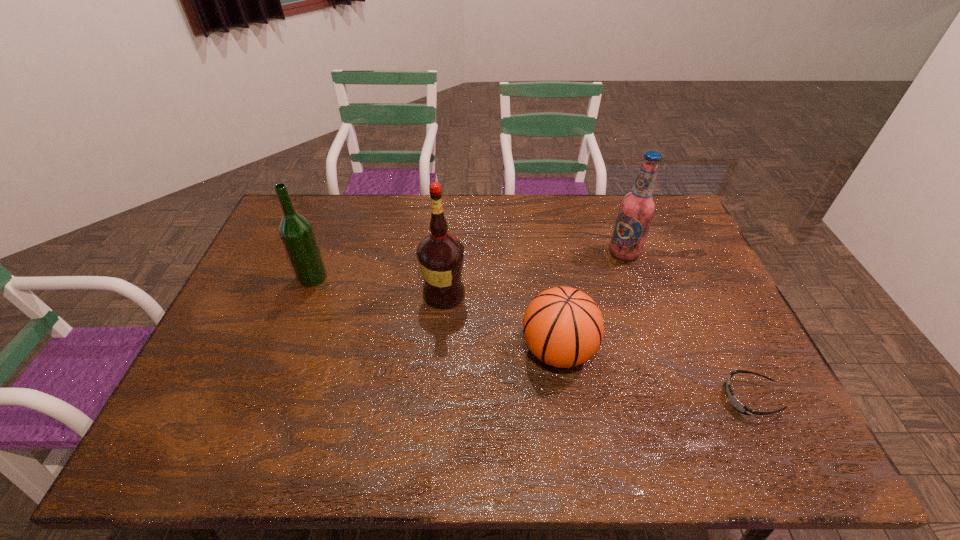
Where is `the second object from left to right`? the second object from left to right is located at coordinates (440, 255).

This screenshot has width=960, height=540. I want to click on the rightmost alcohol, so click(637, 207).

The width and height of the screenshot is (960, 540). In order to click on the farthest alcohol in this screenshot , I will do `click(637, 207)`.

You are a GUI agent. You are given a task and a screenshot of the screen. Output one action in this format:
    pyautogui.click(x=<x>, y=<y>)
    Task: Click on the leftmost alcohol
    The width and height of the screenshot is (960, 540).
    Given the screenshot: What is the action you would take?
    pyautogui.click(x=296, y=232)

The width and height of the screenshot is (960, 540). I want to click on the second shortest object, so (x=563, y=327).

Where is `basketball`? basketball is located at coordinates (563, 327).

You are a GUI agent. You are given a task and a screenshot of the screen. Output one action in this format:
    pyautogui.click(x=<x>, y=<y>)
    Task: Click on the sunglasses
    This screenshot has height=540, width=960.
    Given the screenshot: What is the action you would take?
    pyautogui.click(x=736, y=404)

Identify the location of the shortest object. tap(736, 404).

Where is `vacant space located 0.360m on the label of the fourth object from right to left`? vacant space located 0.360m on the label of the fourth object from right to left is located at coordinates (585, 294).

Where is `free spot located 0.140m on the front of the farthest alcohol`? The width and height of the screenshot is (960, 540). free spot located 0.140m on the front of the farthest alcohol is located at coordinates (638, 295).